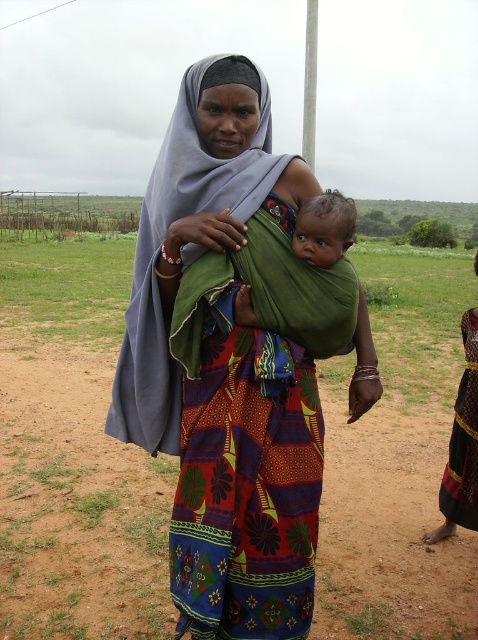
You are a fashion designer observing a woman in a rural area wearing two different dresses. The woman is wearing the multicolored fabric dress at center and the dark red textured fabric dress at lower right. Which dress is taller?

The multicolored fabric dress at center is taller than the dark red textured fabric dress at lower right.

You are a photographer trying to capture both the multicolored fabric dress at center and the dark red textured fabric dress at lower right in the same frame. Which dress should you focus on first to ensure both are in focus?

You should focus on the multicolored fabric dress at center first because it is closer to the viewer than the dark red textured fabric dress at lower right, so adjusting focus from near to far will help both be in focus.

You are a photographer positioned at the center of the scene. You want to take a photo of the point at coordinates point (117, 408) and point (470, 416). Which point will appear closer to the camera in the photo?

Point (117, 408) is in front of point (470, 416), so it will appear closer to the camera in the photo.